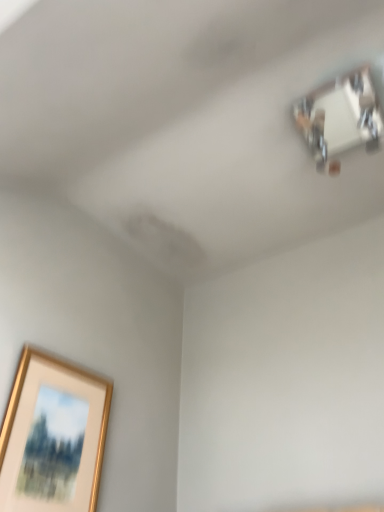
Question: Is gold metallic picture frame at lower left taller than metallic reflective mirror at upper right?

Choices:
 (A) yes
 (B) no

Answer: (A)

Question: Does gold metallic picture frame at lower left come in front of metallic reflective mirror at upper right?

Choices:
 (A) no
 (B) yes

Answer: (B)

Question: Considering the relative sizes of gold metallic picture frame at lower left and metallic reflective mirror at upper right in the image provided, is gold metallic picture frame at lower left thinner than metallic reflective mirror at upper right?

Choices:
 (A) yes
 (B) no

Answer: (A)

Question: From a real-world perspective, is gold metallic picture frame at lower left physically below metallic reflective mirror at upper right?

Choices:
 (A) no
 (B) yes

Answer: (B)

Question: From a real-world perspective, is gold metallic picture frame at lower left over metallic reflective mirror at upper right?

Choices:
 (A) no
 (B) yes

Answer: (A)

Question: Considering the relative sizes of gold metallic picture frame at lower left and metallic reflective mirror at upper right in the image provided, is gold metallic picture frame at lower left wider than metallic reflective mirror at upper right?

Choices:
 (A) yes
 (B) no

Answer: (B)

Question: Does metallic reflective mirror at upper right come behind gold metallic picture frame at lower left?

Choices:
 (A) yes
 (B) no

Answer: (A)

Question: Can you confirm if metallic reflective mirror at upper right is positioned to the right of gold metallic picture frame at lower left?

Choices:
 (A) no
 (B) yes

Answer: (B)

Question: Can you confirm if metallic reflective mirror at upper right is thinner than gold metallic picture frame at lower left?

Choices:
 (A) no
 (B) yes

Answer: (A)

Question: Is metallic reflective mirror at upper right positioned far away from gold metallic picture frame at lower left?

Choices:
 (A) yes
 (B) no

Answer: (A)

Question: Does metallic reflective mirror at upper right have a smaller size compared to gold metallic picture frame at lower left?

Choices:
 (A) no
 (B) yes

Answer: (A)

Question: From a real-world perspective, is metallic reflective mirror at upper right positioned under gold metallic picture frame at lower left based on gravity?

Choices:
 (A) no
 (B) yes

Answer: (A)

Question: From a real-world perspective, is gold metallic picture frame at lower left above or below metallic reflective mirror at upper right?

Choices:
 (A) below
 (B) above

Answer: (A)